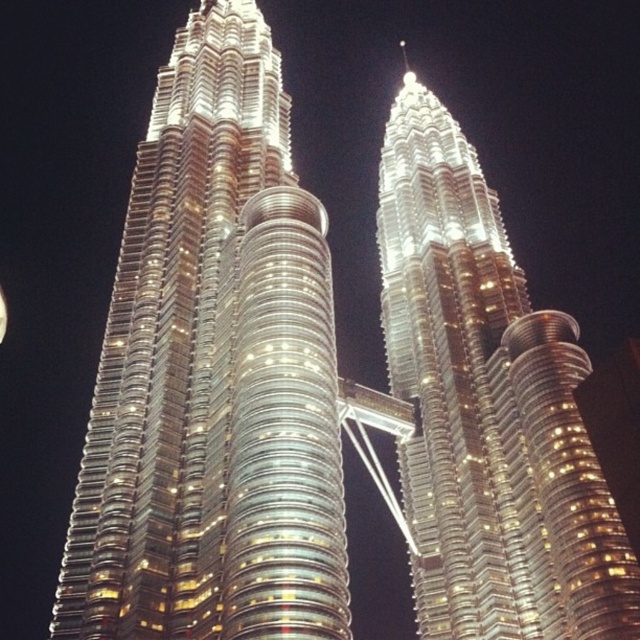
Who is more distant from viewer, (x=502, y=264) or (x=1, y=314)?

Positioned behind is point (x=502, y=264).

Between shiny metallic twin towers at center and bright silver moon at upper left, which one has more height?

shiny metallic twin towers at center

This screenshot has width=640, height=640. Describe the element at coordinates (486, 410) in the screenshot. I see `shiny metallic twin towers at center` at that location.

Identify the location of shiny metallic twin towers at center. (486, 410).

Which is below, shiny metallic skyscraper at center or bright silver moon at upper left?

Positioned lower is bright silver moon at upper left.

Consider the image. Who is shorter, shiny metallic skyscraper at center or bright silver moon at upper left?

bright silver moon at upper left

The width and height of the screenshot is (640, 640). I want to click on shiny metallic skyscraper at center, so click(212, 374).

Identify the location of shiny metallic skyscraper at center. The image size is (640, 640). (212, 374).

Does shiny metallic skyscraper at center have a greater width compared to shiny metallic twin towers at center?

Yes, shiny metallic skyscraper at center is wider than shiny metallic twin towers at center.

Measure the distance between point (205, 310) and camera.

A distance of 84.03 meters exists between point (205, 310) and camera.

Find the location of `shiny metallic skyscraper at center`. shiny metallic skyscraper at center is located at coordinates (212, 374).